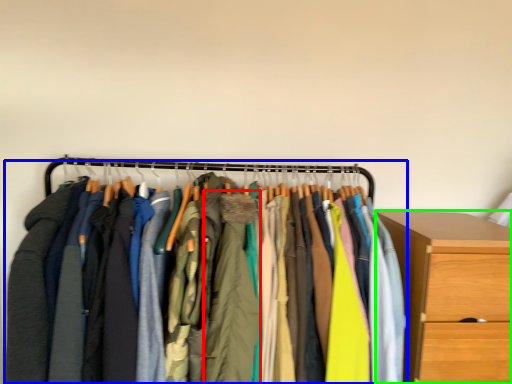
Question: Which object is the closest to the clothing (highlighted by a red box)? Choose among these: closet (highlighted by a blue box) or chest of drawers (highlighted by a green box).

Choices:
 (A) closet
 (B) chest of drawers

Answer: (A)